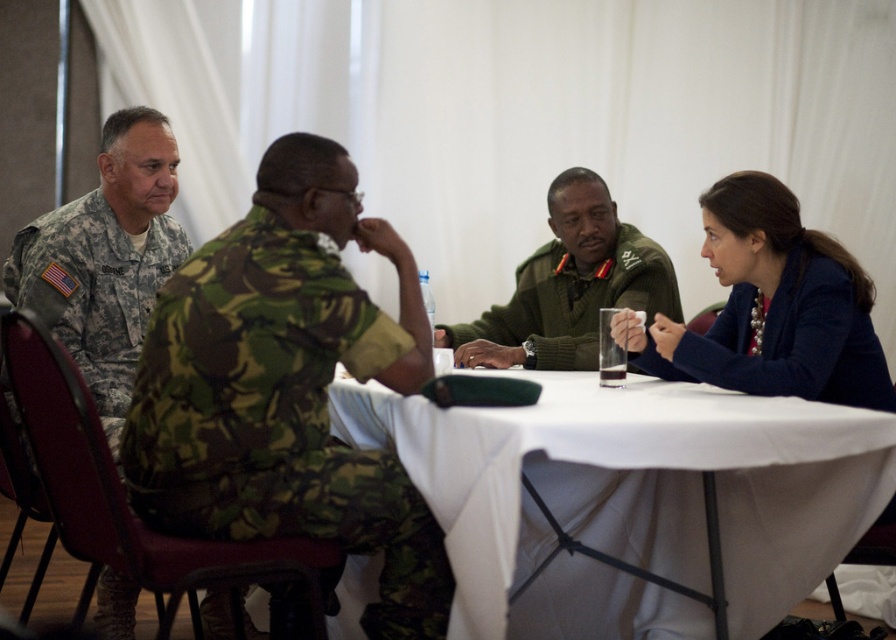
Question: Which point appears closest to the camera in this image?

Choices:
 (A) (119, 576)
 (B) (737, 195)

Answer: (B)

Question: Does camouflage fabric uniform at center appear under camouflage uniform at left?

Choices:
 (A) no
 (B) yes

Answer: (B)

Question: Can you confirm if white cloth table at center is positioned to the left of blue fabric jacket at upper right?

Choices:
 (A) no
 (B) yes

Answer: (B)

Question: Does blue fabric jacket at upper right lie in front of camouflage uniform at left?

Choices:
 (A) no
 (B) yes

Answer: (B)

Question: Which point is closer to the camera?

Choices:
 (A) (237, 476)
 (B) (109, 380)
 (C) (653, 428)

Answer: (C)

Question: Estimate the real-world distances between objects in this image. Which object is farther from the camouflage uniform at left?

Choices:
 (A) blue fabric jacket at upper right
 (B) camouflage fabric uniform at center
 (C) white cloth table at center

Answer: (A)